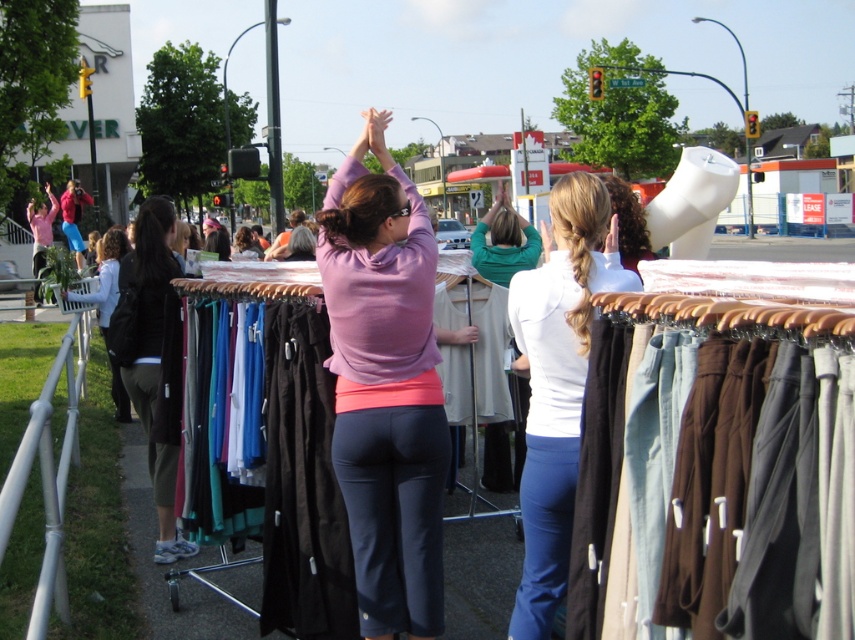
Does white matte shirt at center come in front of dark brown leather jacket at left?

Yes.

In the scene shown: Between white matte shirt at center and dark brown leather jacket at left, which one appears on the left side from the viewer's perspective?

From the viewer's perspective, dark brown leather jacket at left appears more on the left side.

Is point (575, 196) less distant than point (156, 465)?

Yes, it is in front of point (156, 465).

Identify the location of white matte shirt at center. (558, 381).

Can you confirm if matte blue jeans at center is smaller than matte pink sweater at center?

Correct, matte blue jeans at center occupies less space than matte pink sweater at center.

Who is shorter, matte blue jeans at center or matte pink sweater at center?

matte blue jeans at center is shorter.

Image resolution: width=855 pixels, height=640 pixels. What do you see at coordinates (74, 216) in the screenshot?
I see `matte blue jeans at center` at bounding box center [74, 216].

In order to click on matte blue jeans at center in this screenshot , I will do `click(74, 216)`.

The width and height of the screenshot is (855, 640). Identify the location of matte purple hoodie at center. (385, 387).

Can you confirm if matte purple hoodie at center is positioned to the right of green jersey at center?

In fact, matte purple hoodie at center is to the left of green jersey at center.

Is point (369, 196) positioned in front of point (485, 476)?

That is True.

At what (x,y) coordinates should I click in order to perform the action: click on matte purple hoodie at center. Please return your answer as a coordinate pair (x, y). Image resolution: width=855 pixels, height=640 pixels. Looking at the image, I should click on coord(385,387).